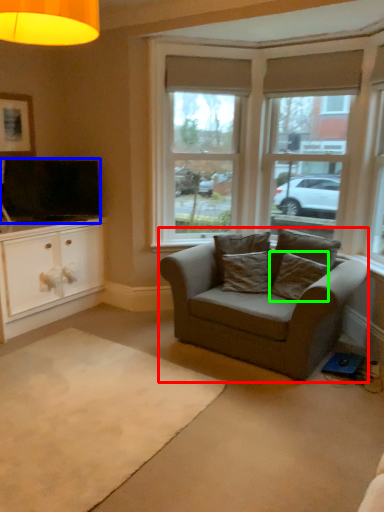
Question: Which object is positioned closest to studio couch (highlighted by a red box)? Select from television (highlighted by a blue box) and pillow (highlighted by a green box).

Choices:
 (A) television
 (B) pillow

Answer: (B)